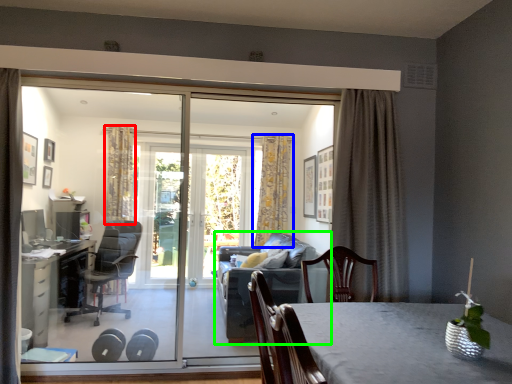
Question: Based on their relative distances, which object is nearer to curtain (highlighted by a red box)? Choose from curtain (highlighted by a blue box) and studio couch (highlighted by a green box).

Choices:
 (A) curtain
 (B) studio couch

Answer: (A)